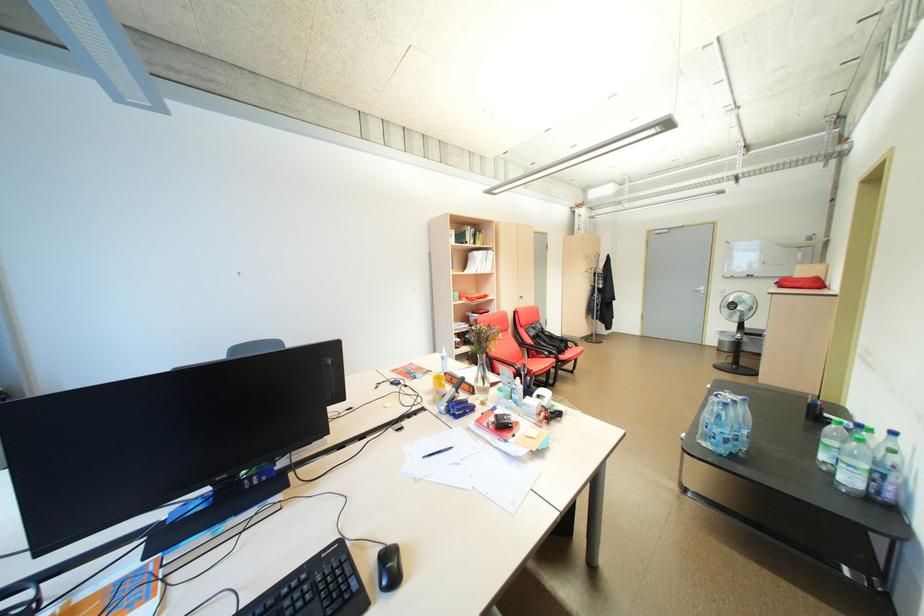
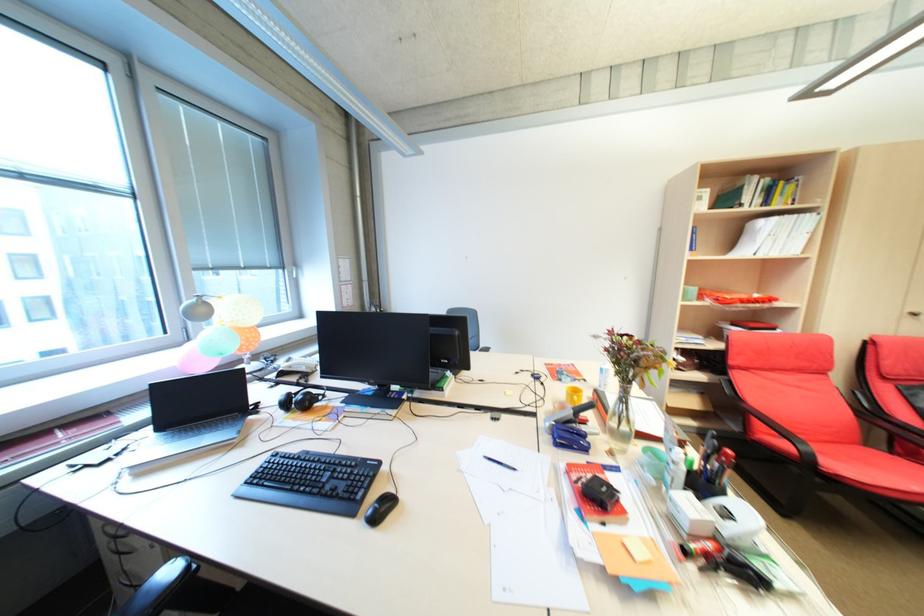
Locate, in the second image, the point that corresponds to the point at 393,583 in the first image.

(379, 514)